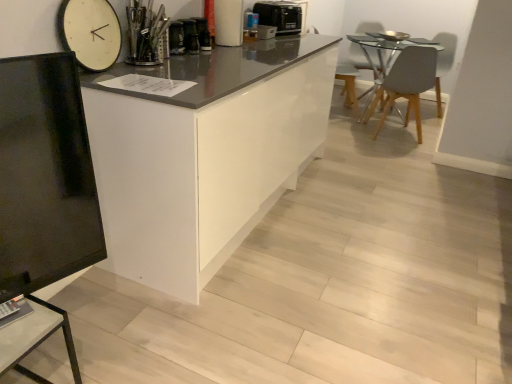
Question: Is white glossy cabinet at center bigger than matte black tv stand at lower left?

Choices:
 (A) no
 (B) yes

Answer: (B)

Question: Is white glossy cabinet at center not near matte black tv stand at lower left?

Choices:
 (A) yes
 (B) no

Answer: (A)

Question: From a real-world perspective, is white glossy cabinet at center positioned over matte black tv stand at lower left based on gravity?

Choices:
 (A) yes
 (B) no

Answer: (A)

Question: Is white glossy cabinet at center not within matte black tv stand at lower left?

Choices:
 (A) yes
 (B) no

Answer: (A)

Question: Is white glossy cabinet at center turned away from matte black tv stand at lower left?

Choices:
 (A) yes
 (B) no

Answer: (B)

Question: Is white glossy cabinet at center smaller than matte black tv stand at lower left?

Choices:
 (A) yes
 (B) no

Answer: (B)

Question: From a real-world perspective, does white glossy cabinet at center stand above gray matte chair at right?

Choices:
 (A) yes
 (B) no

Answer: (A)

Question: From the image's perspective, is white glossy cabinet at center beneath gray matte chair at right?

Choices:
 (A) yes
 (B) no

Answer: (A)

Question: Is white glossy cabinet at center to the left of gray matte chair at right from the viewer's perspective?

Choices:
 (A) yes
 (B) no

Answer: (A)

Question: Is white glossy cabinet at center positioned before gray matte chair at right?

Choices:
 (A) no
 (B) yes

Answer: (B)

Question: Considering the relative positions of white glossy cabinet at center and gray matte chair at right in the image provided, is white glossy cabinet at center behind gray matte chair at right?

Choices:
 (A) no
 (B) yes

Answer: (A)

Question: Is white glossy cabinet at center smaller than gray matte chair at right?

Choices:
 (A) no
 (B) yes

Answer: (A)

Question: From the image's perspective, does matte gray swivel chair at upper right, the 2th swivel chair positioned from the left, appear higher than white wooden clock at upper left?

Choices:
 (A) yes
 (B) no

Answer: (A)